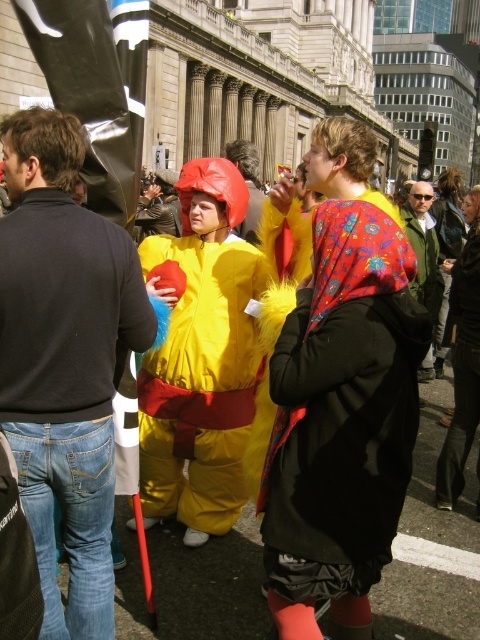
You are standing in the middle of the street and want to walk towards the two points marked in the image. Which point, point (291, 400) or point (193, 388), will you reach first?

Point (291, 400) is closer to the viewer than point (193, 388), so you will reach point (291, 400) first.

Based on the photo, you are a photographer trying to capture both the floral fabric hood at center and the yellow fuzzy costume at center in a single frame. Which object should you focus on first to ensure both are in the shot?

The floral fabric hood at center is smaller than the yellow fuzzy costume at center, so you should focus on the yellow fuzzy costume at center first to ensure both are in the shot.

You are a photographer trying to capture the entire scene in one shot. The floral fabric hood at center and the yellow fuzzy costume at center are both in your frame. Which object is wider in the image?

The floral fabric hood at center is wider than the yellow fuzzy costume at center according to the description.